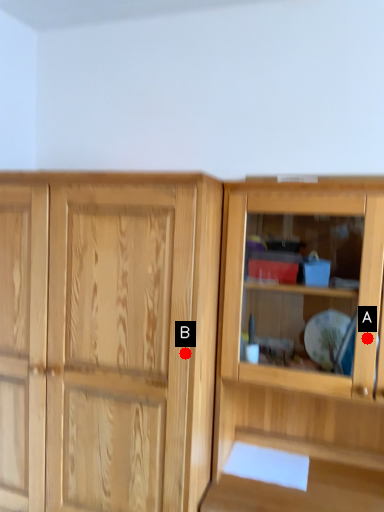
Question: Two points are circled on the image, labeled by A and B beside each circle. Which point is farther from the camera taking this photo?

Choices:
 (A) A is further
 (B) B is further

Answer: (A)